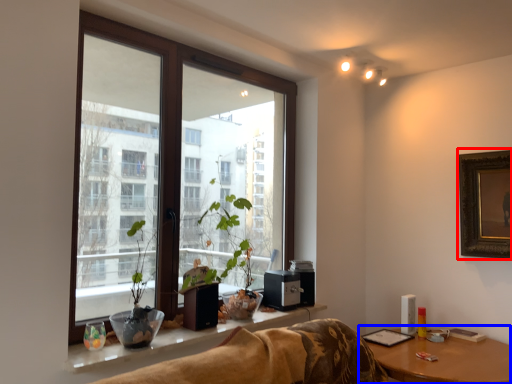
Question: Among these objects, which one is farthest to the camera, picture frame (highlighted by a red box) or table (highlighted by a blue box)?

Choices:
 (A) picture frame
 (B) table

Answer: (A)